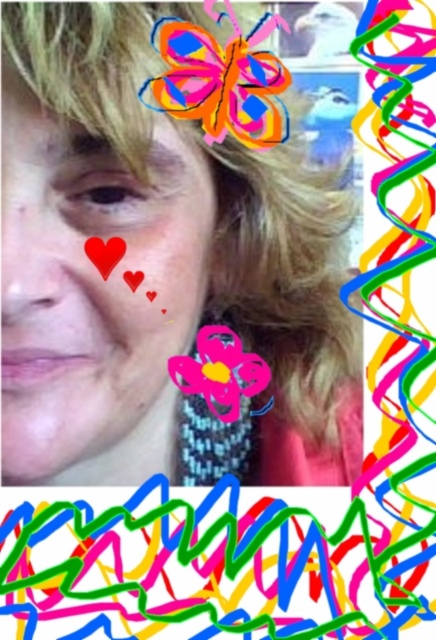
Question: Which point is farther to the camera?

Choices:
 (A) pink matte heart at upper left
 (B) matte red heart at upper left
 (C) multicolored paper butterfly at upper center

Answer: (B)

Question: Is matte skin face at left bigger than multicolored paper butterfly at upper center?

Choices:
 (A) yes
 (B) no

Answer: (A)

Question: Which point is closer to the camera?

Choices:
 (A) matte skin face at left
 (B) multicolored paper butterfly at upper center

Answer: (A)

Question: Where is matte skin face at left located in relation to multicolored paper butterfly at upper center in the image?

Choices:
 (A) below
 (B) above

Answer: (A)

Question: Which point is farther to the camera?

Choices:
 (A) matte skin face at left
 (B) multicolored paper butterfly at upper center

Answer: (B)

Question: Can you confirm if multicolored paper butterfly at upper center is thinner than pink matte heart at upper left?

Choices:
 (A) yes
 (B) no

Answer: (B)